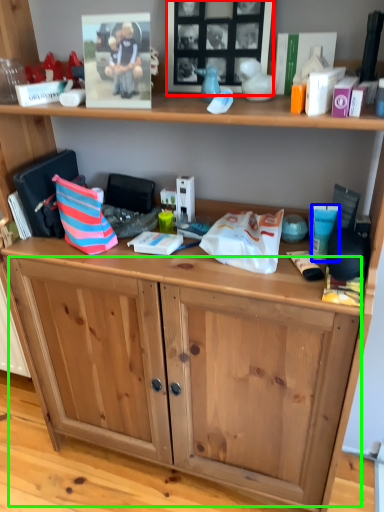
Question: Considering the real-world distances, which object is closest to picture frame (highlighted by a red box)? toiletry (highlighted by a blue box) or drawer (highlighted by a green box).

Choices:
 (A) toiletry
 (B) drawer

Answer: (A)